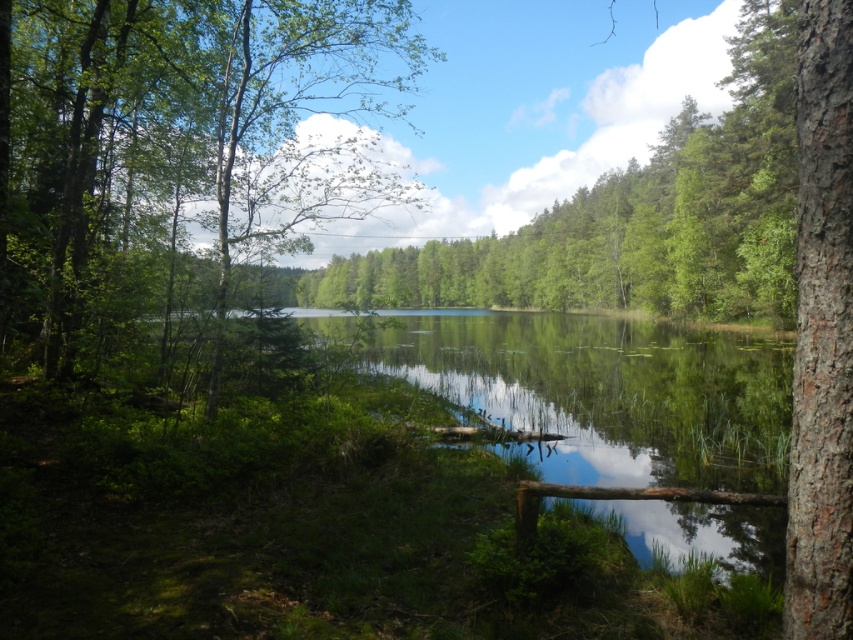
Question: Does green leafy tree at center appear over brown rough bark tree at right?

Choices:
 (A) yes
 (B) no

Answer: (A)

Question: Which point appears farthest from the camera in this image?

Choices:
 (A) (833, 576)
 (B) (114, 278)

Answer: (B)

Question: Which of the following is the closest to the observer?

Choices:
 (A) (560, 392)
 (B) (836, 8)
 (C) (91, 12)
 (D) (575, 195)

Answer: (B)

Question: Does green reflective water at center have a smaller size compared to brown rough bark tree at right?

Choices:
 (A) no
 (B) yes

Answer: (A)

Question: Is green reflective water at center to the left of brown rough bark tree at right from the viewer's perspective?

Choices:
 (A) yes
 (B) no

Answer: (B)

Question: Which point is closer to the camera taking this photo?

Choices:
 (A) (798, 112)
 (B) (775, 436)

Answer: (A)